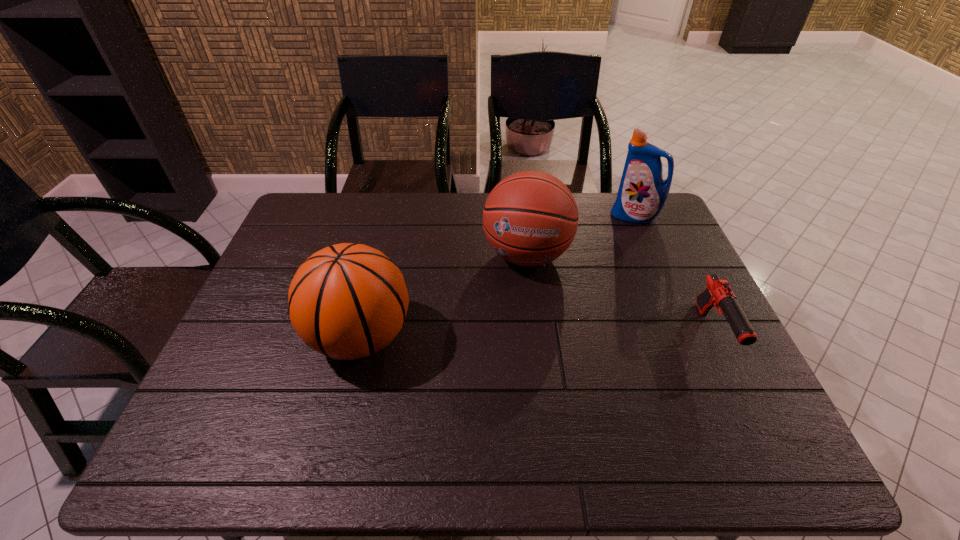
Locate an element on the screen. The image size is (960, 540). vacant space located on the label of the detergent is located at coordinates click(595, 271).

What are the coordinates of `vacant space located 0.330m on the logo side of the right basketball` in the screenshot? It's located at (499, 383).

You are a GUI agent. You are given a task and a screenshot of the screen. Output one action in this format:
    pyautogui.click(x=<x>, y=<y>)
    Task: Click on the vacant space located on the logo side of the right basketball
    The width and height of the screenshot is (960, 540).
    Given the screenshot: What is the action you would take?
    pyautogui.click(x=512, y=325)

At what (x,y) coordinates should I click in order to perform the action: click on free region located 0.390m on the logo side of the right basketball. Please return your answer as a coordinate pair (x, y). The width and height of the screenshot is (960, 540). Looking at the image, I should click on (494, 407).

At what (x,y) coordinates should I click in order to perform the action: click on detergent present at the far edge. Please return your answer as a coordinate pair (x, y). Looking at the image, I should click on (642, 194).

I want to click on basketball positioned at the far edge, so click(x=530, y=218).

Locate an element on the screen. This screenshot has width=960, height=540. object that is at the near edge is located at coordinates (348, 301).

Where is `gun situated at the right edge`? This screenshot has width=960, height=540. gun situated at the right edge is located at coordinates (x=718, y=293).

This screenshot has width=960, height=540. In order to click on detergent located at the right edge in this screenshot , I will do `click(642, 194)`.

Locate an element on the screen. object located in the far right corner section of the desktop is located at coordinates (642, 194).